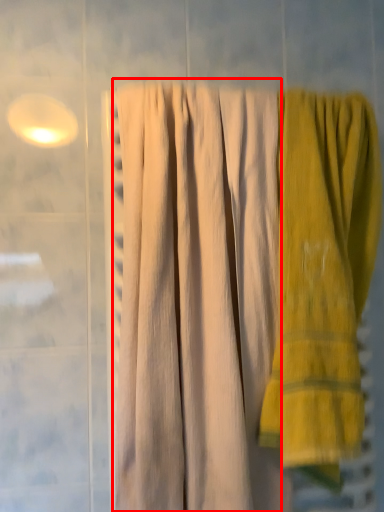
Question: Considering the relative positions of curtain (annotated by the red box) and towel in the image provided, where is curtain (annotated by the red box) located with respect to the staircase?

Choices:
 (A) right
 (B) left

Answer: (B)